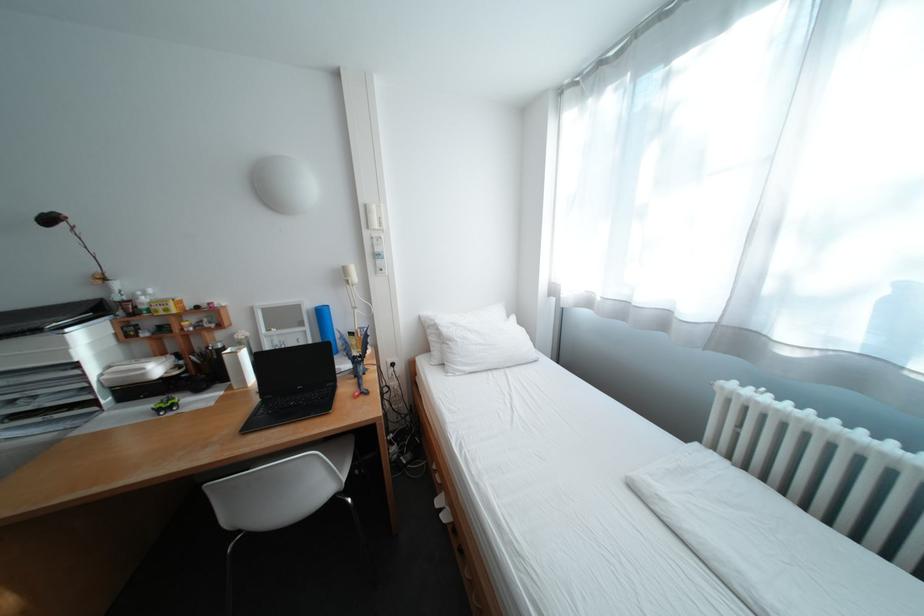
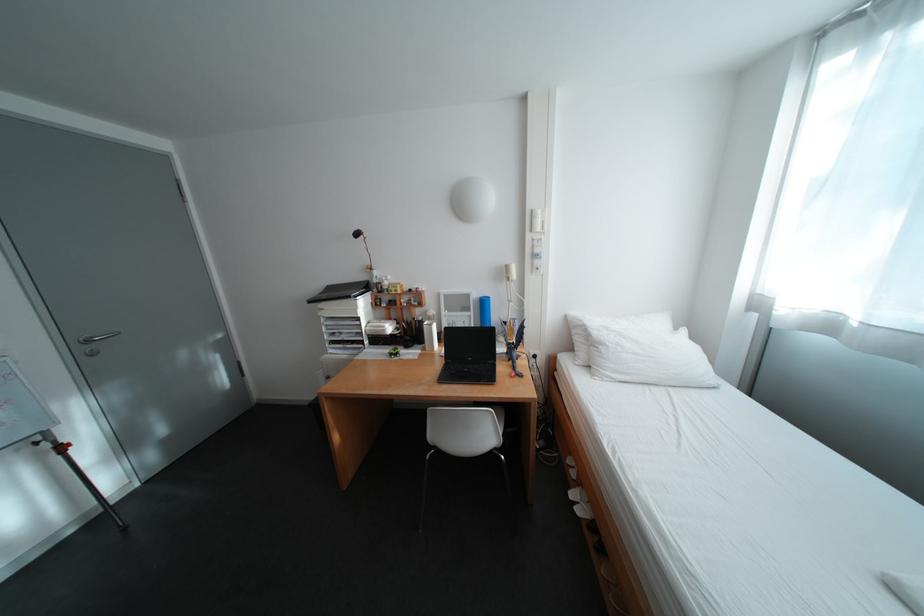
In the second image, find the point that corresponds to (465,342) in the first image.

(614, 346)